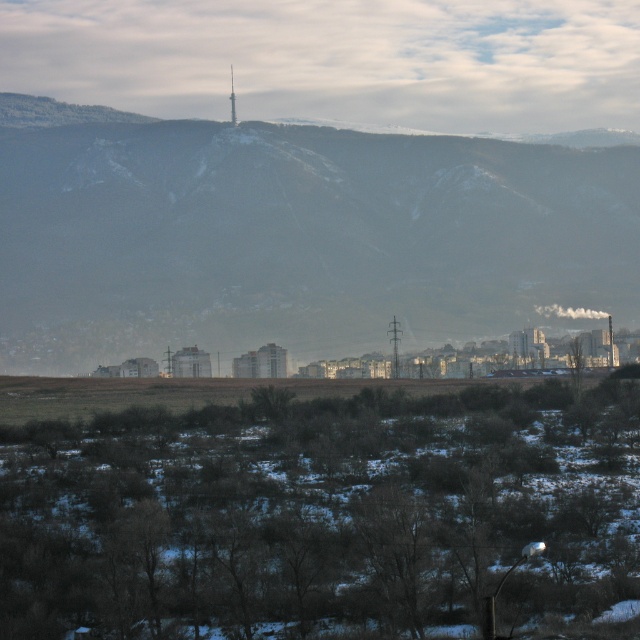
Question: Is snowy mountain range at upper center above metallic silver tower at center?

Choices:
 (A) no
 (B) yes

Answer: (A)

Question: Among these objects, which one is farthest from the camera?

Choices:
 (A) metallic silver tower at center
 (B) snowy mountain range at upper center

Answer: (A)

Question: Does snowy mountain range at upper center appear over metallic silver tower at center?

Choices:
 (A) yes
 (B) no

Answer: (B)

Question: Which object appears farthest from the camera in this image?

Choices:
 (A) metallic silver tower at center
 (B) snowy mountain range at upper center

Answer: (A)

Question: Where is snowy mountain range at upper center located in relation to metallic silver tower at center in the image?

Choices:
 (A) left
 (B) right

Answer: (B)

Question: Which object is farther from the camera taking this photo?

Choices:
 (A) snowy mountain range at upper center
 (B) metallic silver tower at center

Answer: (B)